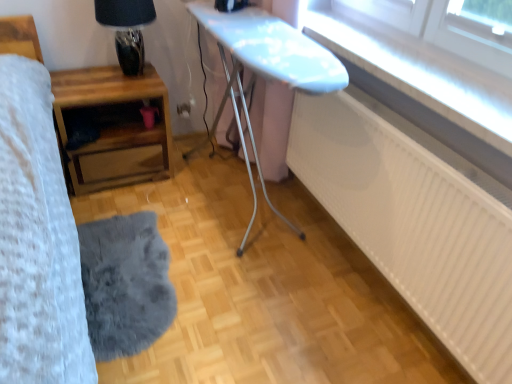
Measure the distance between matte glass table lamp at upper left and camera.

matte glass table lamp at upper left and camera are 1.93 meters apart from each other.

Locate an element on the screen. The image size is (512, 384). gray fluffy mat at lower left is located at coordinates (125, 284).

Between point (106, 8) and point (121, 258), which one is positioned behind?

The point (121, 258) is farther from the camera.

Where is `table lamp on the left side of gray fluffy mat at lower left`? The height and width of the screenshot is (384, 512). table lamp on the left side of gray fluffy mat at lower left is located at coordinates (127, 29).

Is matte glass table lamp at upper left aimed at gray fluffy mat at lower left?

No.

Is matte glass table lamp at upper left not inside gray fluffy mat at lower left?

matte glass table lamp at upper left lies outside gray fluffy mat at lower left's area.

Is transparent glass window at upper right outside of white matte radiator at lower right?

Yes, transparent glass window at upper right is located beyond the bounds of white matte radiator at lower right.

Looking at this image, from a real-world perspective, is transparent glass window at upper right beneath white matte radiator at lower right?

No, from a real-world perspective, transparent glass window at upper right is not under white matte radiator at lower right.

Between transparent glass window at upper right and white matte radiator at lower right, which one has smaller width?

white matte radiator at lower right.

From the image's perspective, who appears lower, transparent glass window at upper right or white matte radiator at lower right?

From the image's view, white matte radiator at lower right is below.

Considering the sizes of objects gray fluffy mat at lower left and white matte radiator at lower right in the image provided, who is thinner, gray fluffy mat at lower left or white matte radiator at lower right?

Thinner between the two is white matte radiator at lower right.

Measure the distance between gray fluffy mat at lower left and white matte radiator at lower right.

The distance of gray fluffy mat at lower left from white matte radiator at lower right is 3.42 feet.

In the image, is gray fluffy mat at lower left positioned in front of or behind white matte radiator at lower right?

gray fluffy mat at lower left is behind white matte radiator at lower right.

Which is in front, point (97, 266) or point (444, 183)?

The point (444, 183) is closer.

Is transparent glass window at upper right beside wooden nightstand at left, which appears as the first table when viewed from the left?

No, transparent glass window at upper right is not next to wooden nightstand at left, which appears as the first table when viewed from the left.

Does transparent glass window at upper right have a larger size compared to wooden nightstand at left, which ranks as the second table in right-to-left order?

Actually, transparent glass window at upper right might be smaller than wooden nightstand at left, which ranks as the second table in right-to-left order.

Considering the points (492, 114) and (85, 189), which point is in front, point (492, 114) or point (85, 189)?

Point (492, 114)

Does transparent glass window at upper right have a lesser height compared to wooden nightstand at left, which ranks as the second table in right-to-left order?

Yes.

Consider the image. Is white matte radiator at lower right far from wooden nightstand at left, which ranks as the second table in right-to-left order?

Yes.

Is white matte radiator at lower right inside the boundaries of wooden nightstand at left, which ranks as the second table in right-to-left order, or outside?

white matte radiator at lower right is not inside wooden nightstand at left, which ranks as the second table in right-to-left order, it's outside.

Can you confirm if white matte radiator at lower right is positioned to the left of wooden nightstand at left, which ranks as the second table in right-to-left order?

Incorrect, white matte radiator at lower right is not on the left side of wooden nightstand at left, which ranks as the second table in right-to-left order.

Between white matte radiator at lower right and wooden nightstand at left, which appears as the first table when viewed from the left, which one has larger size?

white matte radiator at lower right.

Is white glossy ironing board at center, the second table viewed from the left, inside or outside of wooden nightstand at left, which ranks as the second table in right-to-left order?

white glossy ironing board at center, the second table viewed from the left, is located beyond the bounds of wooden nightstand at left, which ranks as the second table in right-to-left order.

In terms of size, does white glossy ironing board at center, which appears as the first table when viewed from the right, appear bigger or smaller than wooden nightstand at left, which appears as the first table when viewed from the left?

Considering their sizes, white glossy ironing board at center, which appears as the first table when viewed from the right, takes up more space than wooden nightstand at left, which appears as the first table when viewed from the left.

Find the location of `table on the right of wooden nightstand at left, which ranks as the second table in right-to-left order`. table on the right of wooden nightstand at left, which ranks as the second table in right-to-left order is located at coordinates (267, 68).

Is white glossy ironing board at center, the second table viewed from the left, shorter than wooden nightstand at left, which appears as the first table when viewed from the left?

No, white glossy ironing board at center, the second table viewed from the left, is not shorter than wooden nightstand at left, which appears as the first table when viewed from the left.

In the scene shown: Would you say white matte radiator at lower right is a long distance from white glossy ironing board at center, the second table viewed from the left?

They are positioned close to each other.

Considering the sizes of objects white matte radiator at lower right and white glossy ironing board at center, the second table viewed from the left, in the image provided, who is shorter, white matte radiator at lower right or white glossy ironing board at center, the second table viewed from the left,?

Standing shorter between the two is white matte radiator at lower right.

Is white matte radiator at lower right facing away from white glossy ironing board at center, which appears as the first table when viewed from the right?

No, white matte radiator at lower right's orientation is not away from white glossy ironing board at center, which appears as the first table when viewed from the right.

Locate an element on the screen. The image size is (512, 384). table lamp located on the left of gray fluffy mat at lower left is located at coordinates (127, 29).

Image resolution: width=512 pixels, height=384 pixels. I want to click on radiator beneath the transparent glass window at upper right (from a real-world perspective), so click(415, 219).

Considering their positions, is gray fluffy mat at lower left positioned closer to white glossy ironing board at center, which appears as the first table when viewed from the right, than matte glass table lamp at upper left?

Based on the image, matte glass table lamp at upper left appears to be nearer to white glossy ironing board at center, which appears as the first table when viewed from the right.

Considering their positions, is transparent glass window at upper right positioned closer to matte glass table lamp at upper left than white matte radiator at lower right?

transparent glass window at upper right lies closer to matte glass table lamp at upper left than the other object.

Considering their positions, is wooden nightstand at left, which ranks as the second table in right-to-left order, positioned closer to transparent glass window at upper right than gray fluffy mat at lower left?

wooden nightstand at left, which ranks as the second table in right-to-left order, is closer to transparent glass window at upper right.

Looking at the image, which one is located further to gray fluffy mat at lower left, matte glass table lamp at upper left or white glossy ironing board at center, the second table viewed from the left?

matte glass table lamp at upper left lies further to gray fluffy mat at lower left than the other object.

Estimate the real-world distances between objects in this image. Which object is further from white matte radiator at lower right, white glossy ironing board at center, which appears as the first table when viewed from the right, or gray fluffy mat at lower left?

gray fluffy mat at lower left.

Which object lies further to the anchor point gray fluffy mat at lower left, matte glass table lamp at upper left or wooden nightstand at left, which ranks as the second table in right-to-left order?

matte glass table lamp at upper left.

Estimate the real-world distances between objects in this image. Which object is further from white matte radiator at lower right, transparent glass window at upper right or gray fluffy mat at lower left?

gray fluffy mat at lower left lies further to white matte radiator at lower right than the other object.

Based on their spatial positions, is matte glass table lamp at upper left or gray fluffy mat at lower left further from white glossy ironing board at center, which appears as the first table when viewed from the right?

gray fluffy mat at lower left is further to white glossy ironing board at center, which appears as the first table when viewed from the right.

The width and height of the screenshot is (512, 384). Find the location of `table between wooden nightstand at left, which appears as the first table when viewed from the left, and transparent glass window at upper right`. table between wooden nightstand at left, which appears as the first table when viewed from the left, and transparent glass window at upper right is located at coordinates (267, 68).

Locate an element on the screen. mat between wooden nightstand at left, which ranks as the second table in right-to-left order, and white matte radiator at lower right from left to right is located at coordinates (125, 284).

Find the location of a particular element. table between matte glass table lamp at upper left and transparent glass window at upper right from left to right is located at coordinates (267, 68).

Locate an element on the screen. table situated between gray fluffy mat at lower left and white matte radiator at lower right from left to right is located at coordinates (267, 68).